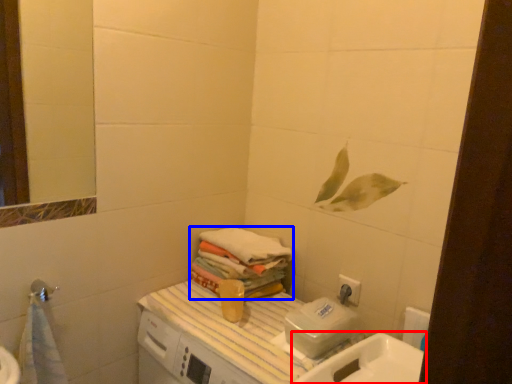
Question: Which object appears closest to the camera in this image, sink (highlighted by a red box) or bath towel (highlighted by a blue box)?

Choices:
 (A) sink
 (B) bath towel

Answer: (A)